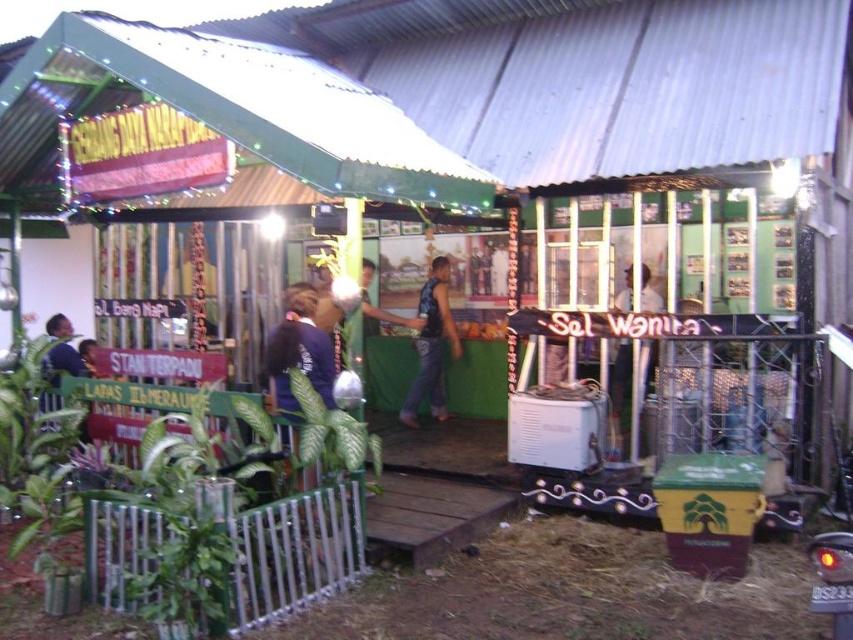
You are an event organizer checking the stage setup. You notice two items at the center of the stage. Which one takes up more space, the dark blue fabric at center or the white glossy shirt at center?

The white glossy shirt at center takes up more space than the dark blue fabric at center because the dark blue fabric at center occupies less space than the white glossy shirt at center.

You are standing at the entrance of the pavilion and want to find the dark blue sleeveless shirt at center. According to the coordinates provided, in which direction should you look to locate it?

The dark blue sleeveless shirt at center is located at coordinates point [431,344], which is slightly to the right and center of the pavilion.